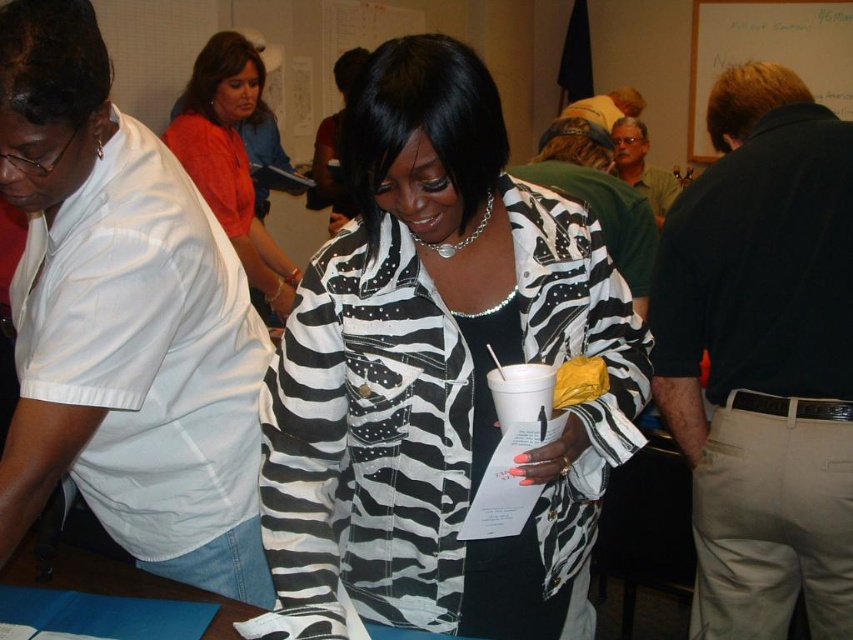
Question: Can you confirm if white paperboard at upper right is positioned to the left of light brown leather jacket at upper center?

Choices:
 (A) yes
 (B) no

Answer: (B)

Question: Can you confirm if matte red blouse at upper left is smaller than light brown leather jacket at upper center?

Choices:
 (A) no
 (B) yes

Answer: (B)

Question: Estimate the real-world distances between objects in this image. Which object is closer to the zebra print jacket at center?

Choices:
 (A) matte red blouse at upper left
 (B) zebra-patterned jacket at center
 (C) light brown leather jacket at upper center

Answer: (A)

Question: Is white shirt at left to the right of light brown leather jacket at upper center from the viewer's perspective?

Choices:
 (A) yes
 (B) no

Answer: (B)

Question: Among these objects, which one is farthest from the camera?

Choices:
 (A) zebra-patterned jacket at center
 (B) white paperboard at upper right
 (C) white shirt at left

Answer: (B)

Question: Which of the following is the closest to the observer?

Choices:
 (A) light brown leather jacket at upper center
 (B) matte red blouse at upper left
 (C) zebra print jacket at center
 (D) zebra-patterned jacket at center

Answer: (D)